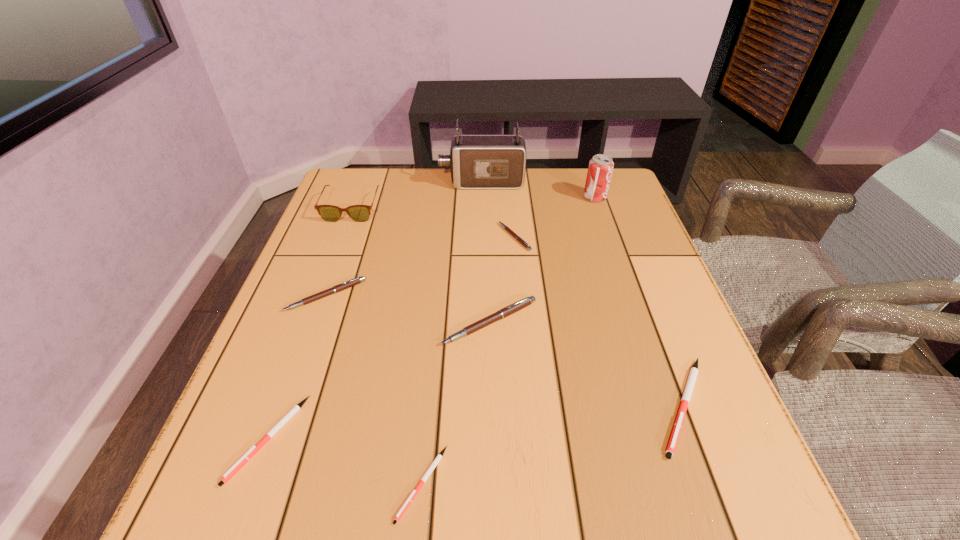
You are a GUI agent. You are given a task and a screenshot of the screen. Output one action in this format:
    pyautogui.click(x=<x>, y=<y>)
    Task: Click on the vacant region between the leftmost white pen and the farthest object
    The width and height of the screenshot is (960, 540).
    Given the screenshot: What is the action you would take?
    pyautogui.click(x=375, y=310)

Where is `unoccupied area between the second smallest white pen and the sixth nearest object`? The height and width of the screenshot is (540, 960). unoccupied area between the second smallest white pen and the sixth nearest object is located at coordinates (392, 338).

Locate an element on the screen. empty space that is in between the leftmost pink pen and the biggest white pen is located at coordinates (504, 350).

Locate an element on the screen. free spot between the farthest pen and the second biggest pink pen is located at coordinates (420, 266).

Choose which object is the seventh nearest neighbor to the second biggest white pen. Please provide its 2D coordinates. Your answer should be formatted as a tuple, i.e. [(x, y)], where the tuple contains the x and y coordinates of a point satisfying the conditions above.

[(477, 161)]

The width and height of the screenshot is (960, 540). I want to click on the fourth closest object to the camcorder, so click(357, 280).

Locate an element on the screen. This screenshot has width=960, height=540. pen that can be found as the fifth closest to the leftmost pink pen is located at coordinates (687, 393).

Select which pen is the second closest to the brown spectacles. Please provide its 2D coordinates. Your answer should be formatted as a tuple, i.e. [(x, y)], where the tuple contains the x and y coordinates of a point satisfying the conditions above.

[(518, 238)]

Select which pink pen is the closest to the second biggest pink pen. Please provide its 2D coordinates. Your answer should be formatted as a tuple, i.e. [(x, y)], where the tuple contains the x and y coordinates of a point satisfying the conditions above.

[(512, 308)]

Select which pink pen is the second closest to the sixth shortest object. Please provide its 2D coordinates. Your answer should be formatted as a tuple, i.e. [(x, y)], where the tuple contains the x and y coordinates of a point satisfying the conditions above.

[(357, 280)]